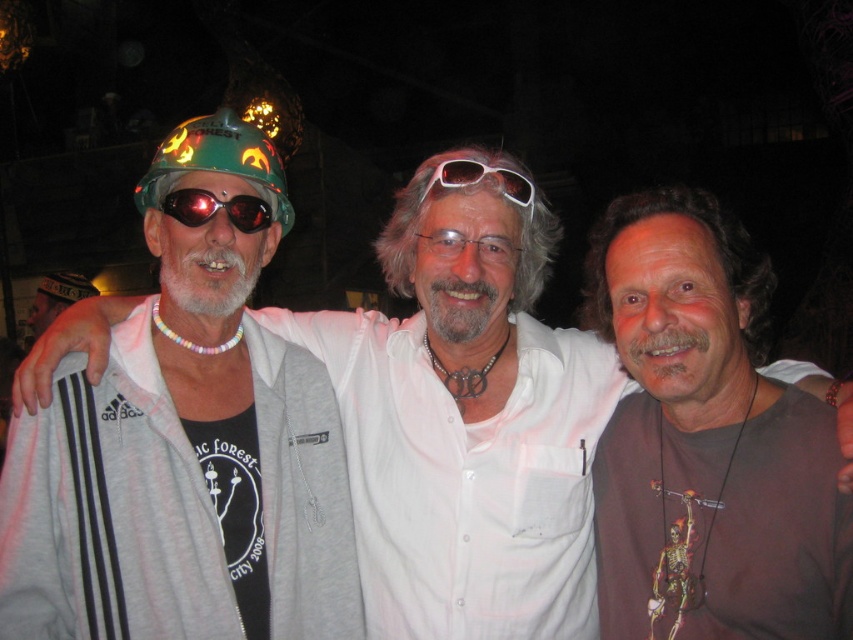
You are standing in front of the photograph and notice the matte green helmet at left. Can you determine its exact position based on the coordinate system provided?

The matte green helmet at left is located at point coordinates (186, 448).